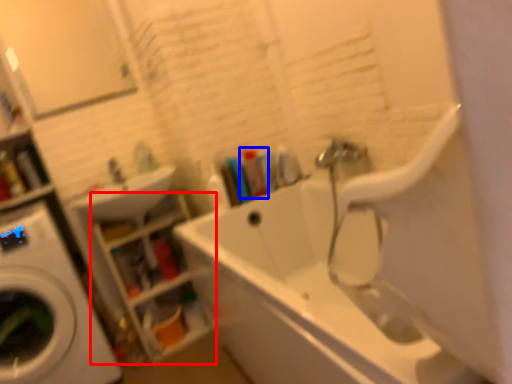
Question: Which of the following is the farthest to the observer, shelf (highlighted by a red box) or toiletry (highlighted by a blue box)?

Choices:
 (A) shelf
 (B) toiletry

Answer: (B)